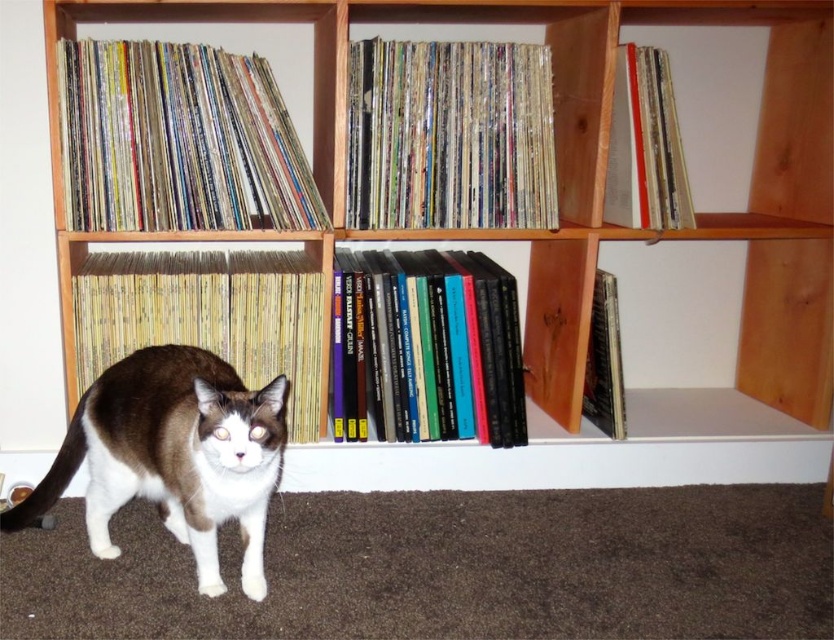
You are a librarian who wants to retrieve the hardcover book at center from the shelf. However, there is a brown and white fur cat at center blocking your path. Can you reach the book without moving the cat?

The brown and white fur cat at center is in front of the hardcover book at center, so you cannot reach the book without moving the cat.

What is located at the point with coordinates (450,134) in the image?

The point with coordinates (450,134) indicates multicolored vinyl records at center.

In the scene shown: You are a librarian trying to organize a new book on the shelf. The book you have is the same height as the matte paper book at upper right. You want to place it on the shelf where the multicolored vinyl records at center are. Will the book fit in terms of height?

The multicolored vinyl records at center has a greater height compared to the matte paper book at upper right. Since your book is the same height as the matte paper book at upper right, it will fit on the shelf where the multicolored vinyl records at center are placed because the shelf can accommodate items of that height or smaller.